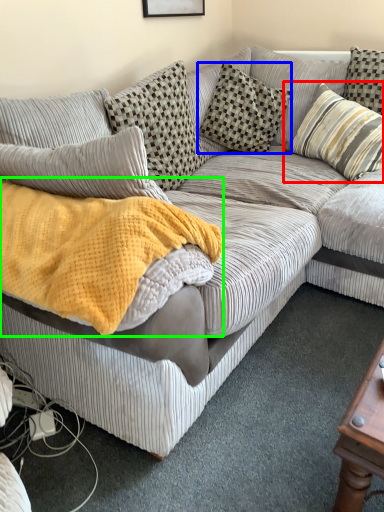
Question: Based on their relative distances, which object is farther from pillow (highlighted by a red box)? Choose from pillow (highlighted by a blue box) and blanket (highlighted by a green box).

Choices:
 (A) pillow
 (B) blanket

Answer: (B)